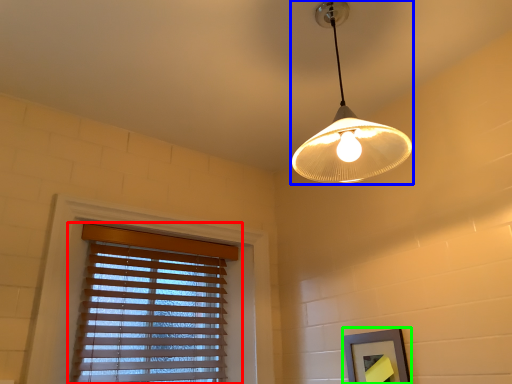
Question: Estimate the real-world distances between objects in this image. Which object is farther from window blind (highlighted by a red box), lamp (highlighted by a blue box) or picture frame (highlighted by a green box)?

Choices:
 (A) lamp
 (B) picture frame

Answer: (A)